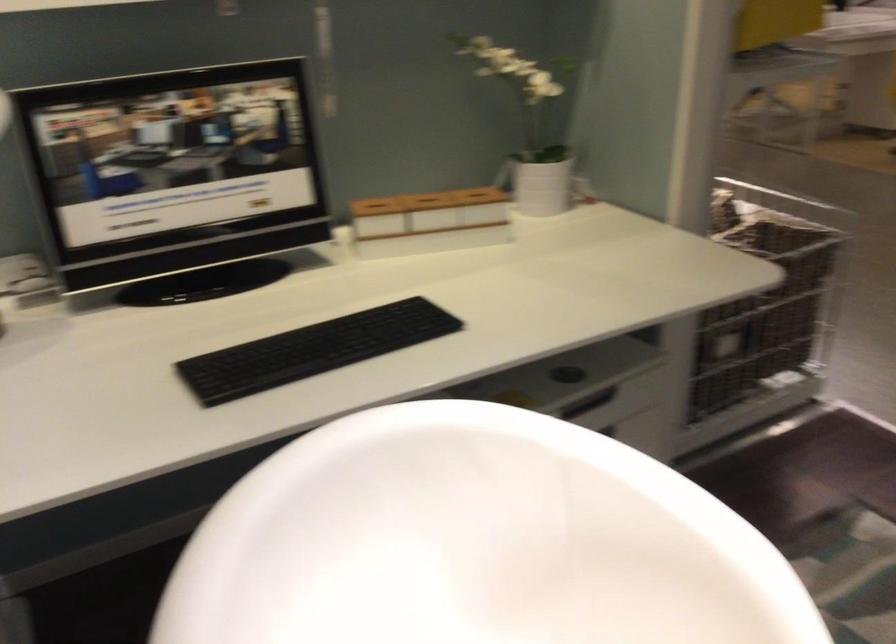
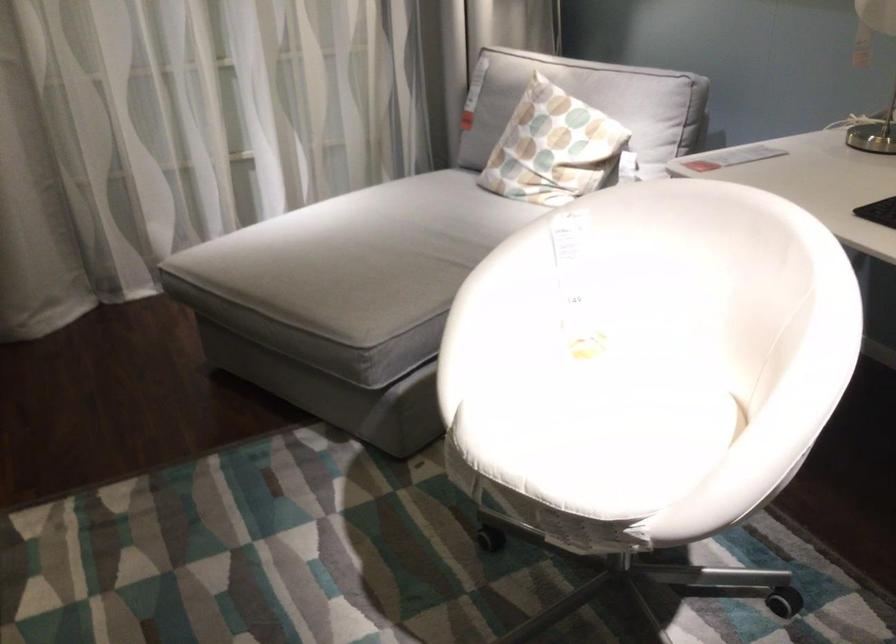
Find the pixel in the second image that matches the point at 757,559 in the first image.

(780, 399)